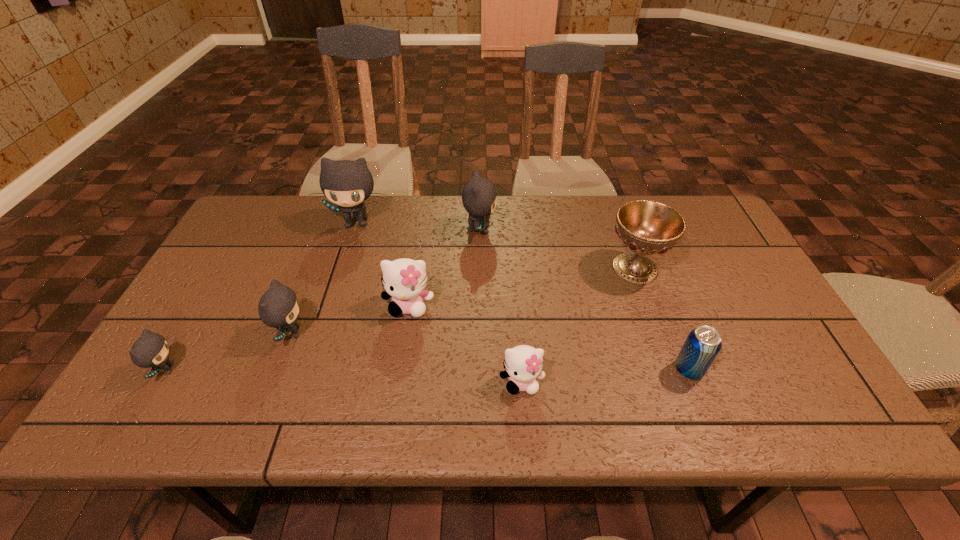
The height and width of the screenshot is (540, 960). Identify the location of vacant space that is in between the rightmost gray kitten and the tallest kitten. (418, 226).

Locate an element on the screen. Image resolution: width=960 pixels, height=540 pixels. free space between the blue beer can and the right white kitten is located at coordinates (605, 376).

Find the location of `vacant space in between the smaller white kitten and the chalice`. vacant space in between the smaller white kitten and the chalice is located at coordinates (578, 325).

Locate an element on the screen. This screenshot has height=540, width=960. empty space that is in between the second biggest gray kitten and the smaller white kitten is located at coordinates (500, 306).

The image size is (960, 540). In order to click on free space between the third smallest gray kitten and the beer can in this screenshot , I will do `click(584, 300)`.

This screenshot has height=540, width=960. I want to click on empty space that is in between the tallest object and the leftmost kitten, so click(x=261, y=296).

Find the location of `vacant space that's between the tallest object and the third biggest gray kitten`. vacant space that's between the tallest object and the third biggest gray kitten is located at coordinates (324, 278).

Identify which object is the fourth nearest to the beer can. Please provide its 2D coordinates. Your answer should be formatted as a tuple, i.e. [(x, y)], where the tuple contains the x and y coordinates of a point satisfying the conditions above.

[(404, 280)]

This screenshot has width=960, height=540. Find the location of `the seventh closest object to the red chalice`. the seventh closest object to the red chalice is located at coordinates (151, 350).

Locate an element on the screen. The height and width of the screenshot is (540, 960). the fourth closest kitten to the tallest object is located at coordinates (151, 350).